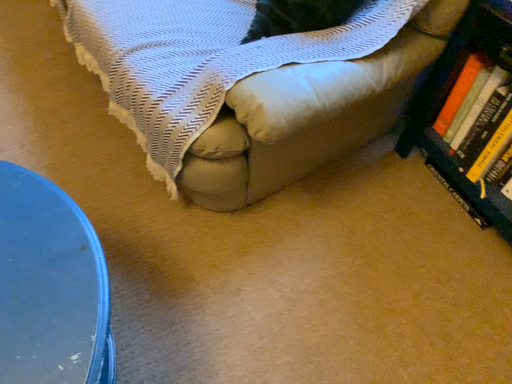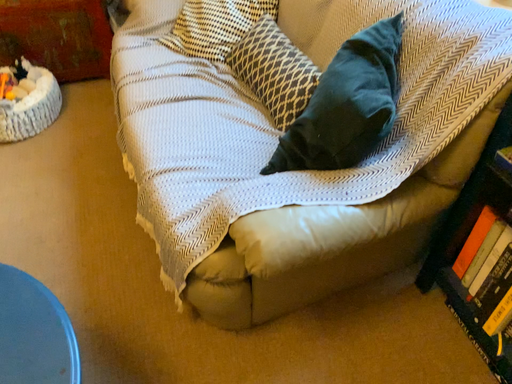
Question: How did the camera likely rotate when shooting the video?

Choices:
 (A) rotated left
 (B) rotated right

Answer: (A)